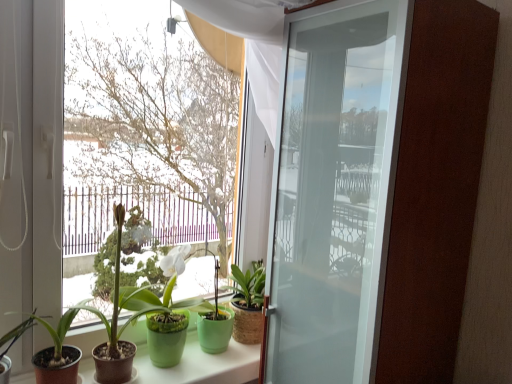
Question: Does burlap-textured plant pot at center, which appears as the fifth houseplant when viewed from the left, have a greater height compared to green matte pot at center, the second houseplant when ordered from right to left?

Choices:
 (A) yes
 (B) no

Answer: (B)

Question: Is burlap-textured plant pot at center, which appears as the fifth houseplant when viewed from the left, shorter than green matte pot at center, the second houseplant when ordered from right to left?

Choices:
 (A) yes
 (B) no

Answer: (A)

Question: From the image's perspective, is burlap-textured plant pot at center, the 1th houseplant in the right-to-left sequence, located above green matte pot at center, which is the fourth houseplant from left to right?

Choices:
 (A) no
 (B) yes

Answer: (A)

Question: Considering the relative positions of burlap-textured plant pot at center, the 1th houseplant in the right-to-left sequence, and green matte pot at center, which is the fourth houseplant from left to right, in the image provided, is burlap-textured plant pot at center, the 1th houseplant in the right-to-left sequence, to the left of green matte pot at center, which is the fourth houseplant from left to right, from the viewer's perspective?

Choices:
 (A) no
 (B) yes

Answer: (A)

Question: Considering the relative sizes of burlap-textured plant pot at center, the 1th houseplant in the right-to-left sequence, and green matte pot at center, which is the fourth houseplant from left to right, in the image provided, is burlap-textured plant pot at center, the 1th houseplant in the right-to-left sequence, thinner than green matte pot at center, which is the fourth houseplant from left to right,?

Choices:
 (A) no
 (B) yes

Answer: (A)

Question: Considering the positions of green matte pot at lower left, positioned as the 5th houseplant in right-to-left order, and green matte pot at lower left, the 2th houseplant viewed from the left, in the image, is green matte pot at lower left, positioned as the 5th houseplant in right-to-left order, bigger or smaller than green matte pot at lower left, the 2th houseplant viewed from the left,?

Choices:
 (A) big
 (B) small

Answer: (B)

Question: Is green matte pot at lower left, positioned as the 5th houseplant in right-to-left order, situated inside green matte pot at lower left, the 2th houseplant viewed from the left, or outside?

Choices:
 (A) inside
 (B) outside

Answer: (A)

Question: Would you say green matte pot at lower left, arranged as the 1th houseplant when viewed from the left, is to the left or to the right of green matte pot at lower left, positioned as the fourth houseplant in right-to-left order, in the picture?

Choices:
 (A) left
 (B) right

Answer: (A)

Question: Relative to green matte pot at lower left, positioned as the fourth houseplant in right-to-left order, is green matte pot at lower left, positioned as the 5th houseplant in right-to-left order, in front or behind?

Choices:
 (A) front
 (B) behind

Answer: (A)

Question: Is transparent glass window at center bigger or smaller than green matte pot at center, placed as the 3th houseplant when sorted from right to left?

Choices:
 (A) big
 (B) small

Answer: (A)

Question: Is transparent glass window at center spatially inside green matte pot at center, placed as the 3th houseplant when sorted from right to left, or outside of it?

Choices:
 (A) inside
 (B) outside

Answer: (B)

Question: Considering the relative positions of transparent glass window at center and green matte pot at center, placed as the 3th houseplant when sorted from right to left, in the image provided, is transparent glass window at center to the left or to the right of green matte pot at center, placed as the 3th houseplant when sorted from right to left,?

Choices:
 (A) left
 (B) right

Answer: (B)

Question: In the image, is transparent glass window at center positioned in front of or behind green matte pot at center, placed as the 3th houseplant when sorted from right to left?

Choices:
 (A) front
 (B) behind

Answer: (A)

Question: From a real-world perspective, relative to green matte pot at center, the second houseplant when ordered from right to left, is transparent glass window at center vertically above or below?

Choices:
 (A) above
 (B) below

Answer: (A)

Question: From the image's perspective, is transparent glass window at center located above or below green matte pot at center, which is the fourth houseplant from left to right?

Choices:
 (A) above
 (B) below

Answer: (A)